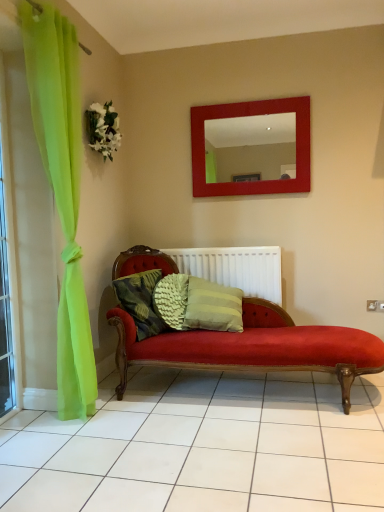
Question: Visually, is white fabric flower at upper left positioned to the left or to the right of clear glass window at left?

Choices:
 (A) left
 (B) right

Answer: (B)

Question: Considering the positions of point (92, 122) and point (6, 370), is point (92, 122) closer or farther from the camera than point (6, 370)?

Choices:
 (A) farther
 (B) closer

Answer: (A)

Question: Estimate the real-world distances between objects in this image. Which object is farther from the clear glass window at left?

Choices:
 (A) red glossy mirror at upper center
 (B) white fabric flower at upper left
 (C) textured green pillow at center
 (D) white plastic radiator at center

Answer: (A)

Question: Which of these objects is positioned farthest from the clear glass window at left?

Choices:
 (A) white fabric flower at upper left
 (B) red glossy mirror at upper center
 (C) textured green pillow at center
 (D) white plastic radiator at center

Answer: (B)